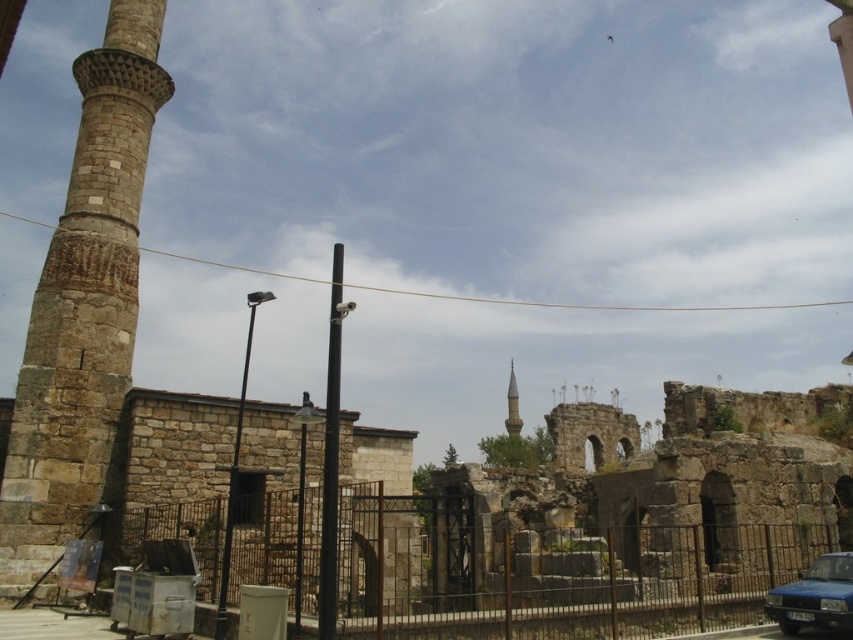
Is blue metallic car at lower right closer to camera compared to smooth stone minaret at center?

Yes, blue metallic car at lower right is closer to the viewer.

This screenshot has height=640, width=853. Describe the element at coordinates (815, 596) in the screenshot. I see `blue metallic car at lower right` at that location.

The height and width of the screenshot is (640, 853). In order to click on blue metallic car at lower right in this screenshot , I will do `click(815, 596)`.

The width and height of the screenshot is (853, 640). I want to click on blue metallic car at lower right, so click(x=815, y=596).

Who is higher up, rusty metal fence at center or smooth stone minaret at center?

rusty metal fence at center

Can you confirm if rusty metal fence at center is smaller than smooth stone minaret at center?

Actually, rusty metal fence at center might be larger than smooth stone minaret at center.

Who is more distant from viewer, (799, 576) or (519, 428)?

The point (519, 428) is behind.

Identify the location of rusty metal fence at center. (558, 573).

Measure the distance between point (749, 531) and camera.

A distance of 189.33 feet exists between point (749, 531) and camera.

Which of these two, rusty metal fence at center or blue metallic car at lower right, stands shorter?

blue metallic car at lower right

Where is `rusty metal fence at center`? rusty metal fence at center is located at coordinates (558, 573).